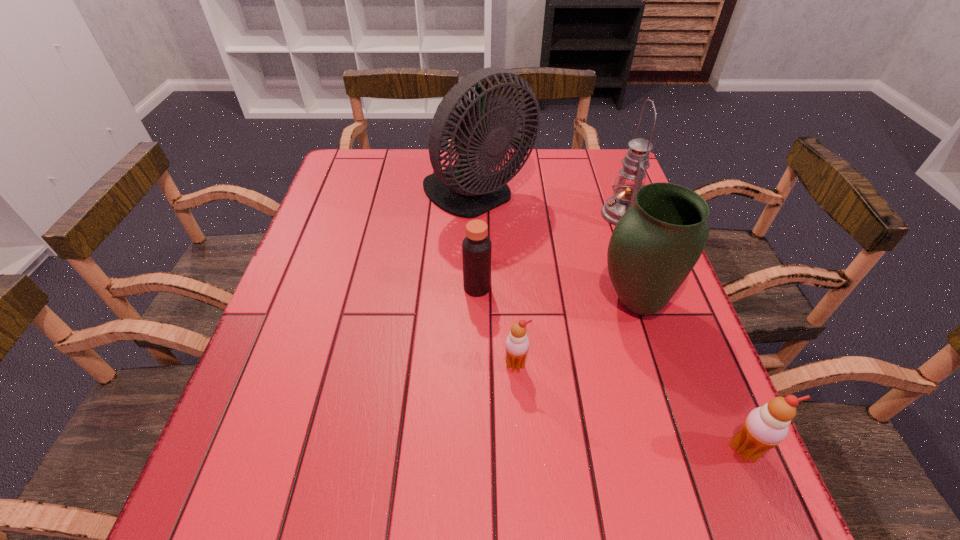
Where is `free spot between the oil lamp and the right icecream`? free spot between the oil lamp and the right icecream is located at coordinates (683, 332).

Locate an element on the screen. The image size is (960, 540). vacant area between the fourth shortest object and the nearest object is located at coordinates (689, 376).

Where is `vacant space that's between the vase and the vinegar`? Image resolution: width=960 pixels, height=540 pixels. vacant space that's between the vase and the vinegar is located at coordinates (556, 295).

At what (x,y) coordinates should I click in order to perform the action: click on object that is the second closest to the vase. Please return your answer as a coordinate pair (x, y). Looking at the image, I should click on (631, 177).

Identify the location of object that is the second closest to the shortest object. The width and height of the screenshot is (960, 540). (654, 246).

Locate an element on the screen. The image size is (960, 540). free space that satisfies the following two spatial constraints: 1. in front of the oil lamp to direct airflow; 2. on the right side of the fan is located at coordinates (477, 214).

Find the location of `blank area in the image that satisfies the following two spatial constraints: 1. in front of the fan to direct airflow; 2. on the right side of the third tallest object`. blank area in the image that satisfies the following two spatial constraints: 1. in front of the fan to direct airflow; 2. on the right side of the third tallest object is located at coordinates (476, 302).

I want to click on free spot that satisfies the following two spatial constraints: 1. in front of the fan to direct airflow; 2. on the left side of the vinegar, so click(x=476, y=288).